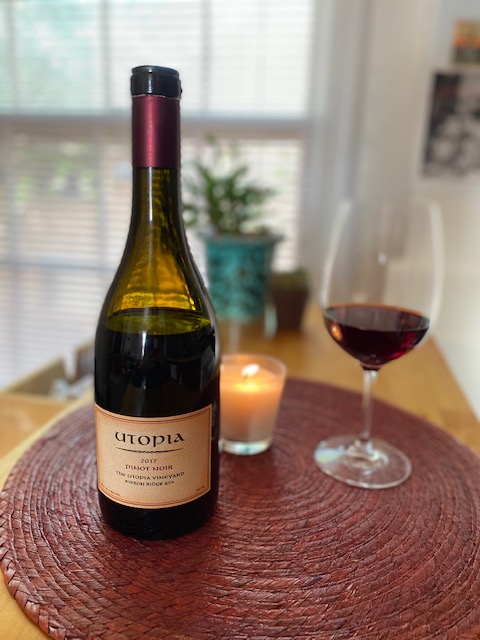
The height and width of the screenshot is (640, 480). I want to click on area of window blinds over window, so click(x=245, y=51), click(x=47, y=320), click(x=51, y=172), click(x=65, y=84).